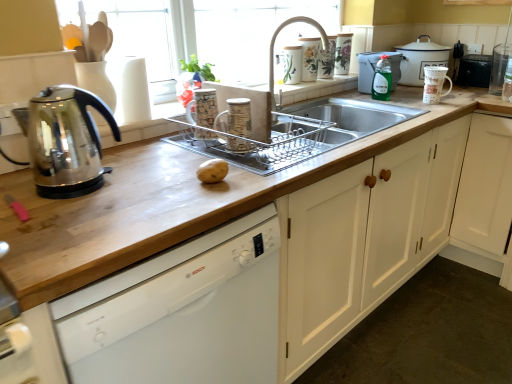
In order to click on free location in front of brown matte potato at center in this screenshot , I will do `click(190, 196)`.